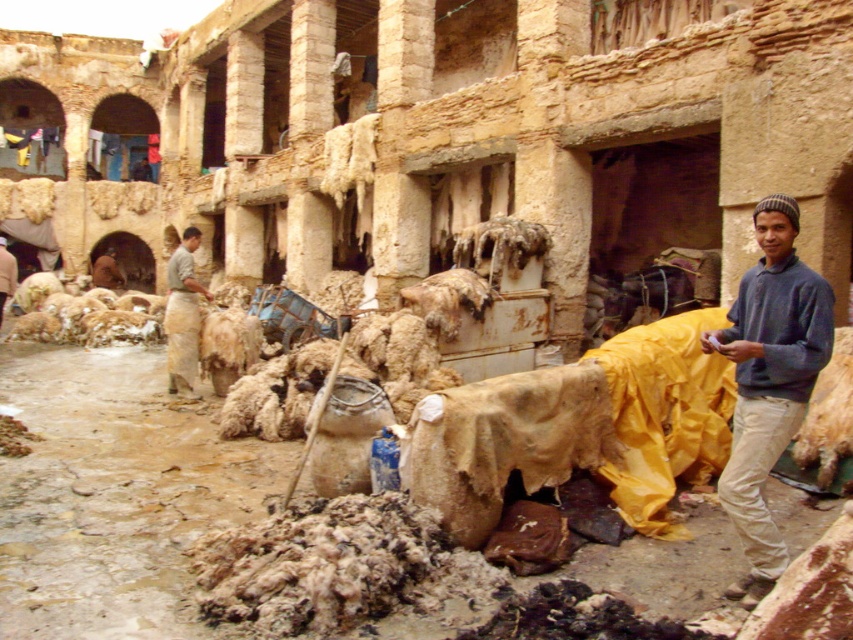
You are a customer looking to purchase a garment. You see the dark blue sweater at right and the brown leather jacket at center. Which one is taller?

The dark blue sweater at right is taller than the brown leather jacket at center.

You are a delivery person who needs to place a package between the dark blue sweater at right and the light brown fabric apron at center. The package is 10 meters long. Will the package fit between them?

The dark blue sweater at right is 10.11 meters from the light brown fabric apron at center, so the package will fit between them since it is slightly shorter than the distance between the two objects.